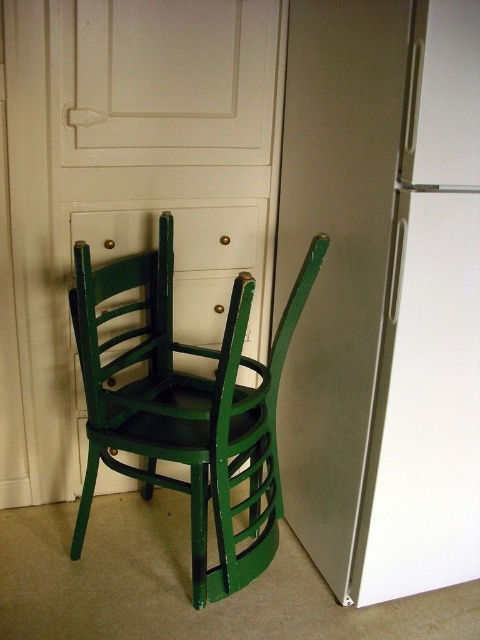
You are organizing the items in the room and need to place a new shelf between the satin white refrigerator at center right and the green matte wood chair at center. Based on their positions, which item should the shelf be placed below?

The shelf should be placed below the satin white refrigerator at center right because it is above the green matte wood chair at center.

You are moving a small plant that is 12 inches wide. You want to place it between the satin white refrigerator at center right and the green matte wood chair at center. Will it fit?

The satin white refrigerator at center right is 13.89 inches away from the green matte wood chair at center. Since the plant is 12 inches wide, it will fit between them as the distance is greater than the plant width.

You are trying to decide whether to place a tall plant next to the satin white refrigerator at center right or the green matte wood chair at center. Based on the height of the objects, which one would be a better fit for the tall plant?

The satin white refrigerator at center right has a greater height compared to the green matte wood chair at center, so placing the tall plant next to the refrigerator would be a better fit as it matches the height scale.